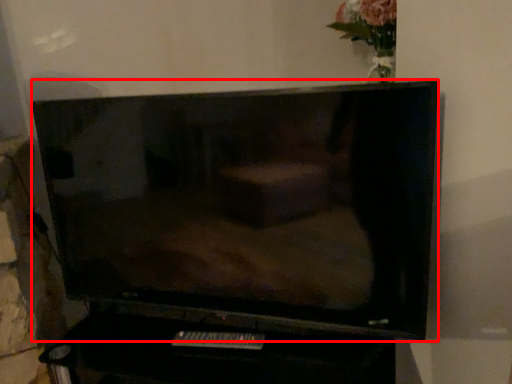
Question: From the image's perspective, where is television (annotated by the red box) located relative to remote?

Choices:
 (A) above
 (B) below

Answer: (A)